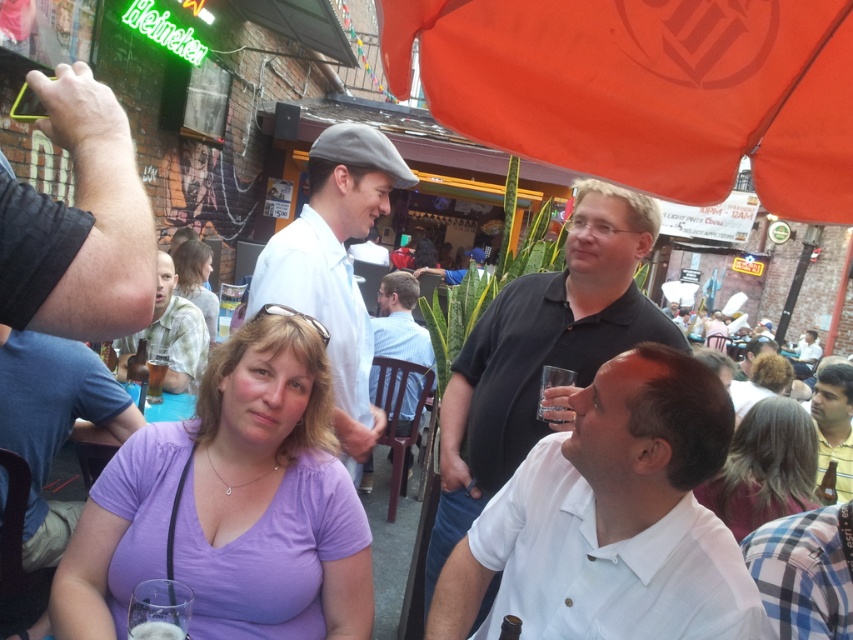
Looking at this image, you are a photographer standing at the edge of the gathering. You want to take a photo that includes both the light blue shirt at center and the blonde hair at center. What is the minimum distance you need to step back to ensure both are in frame?

The light blue shirt at center and blonde hair at center are 1.40 meters apart from each other. To include both in the frame, the photographer should step back at least 1.40 meters to ensure the camera can capture the entire distance between them.

You are standing in the middle of the scene and want to move towards the two points marked in the image. Which point, point [570,314] or point [158,394], is closer to you?

Point [570,314] is closer to the viewer than point [158,394], so you should move towards point [570,314] first.